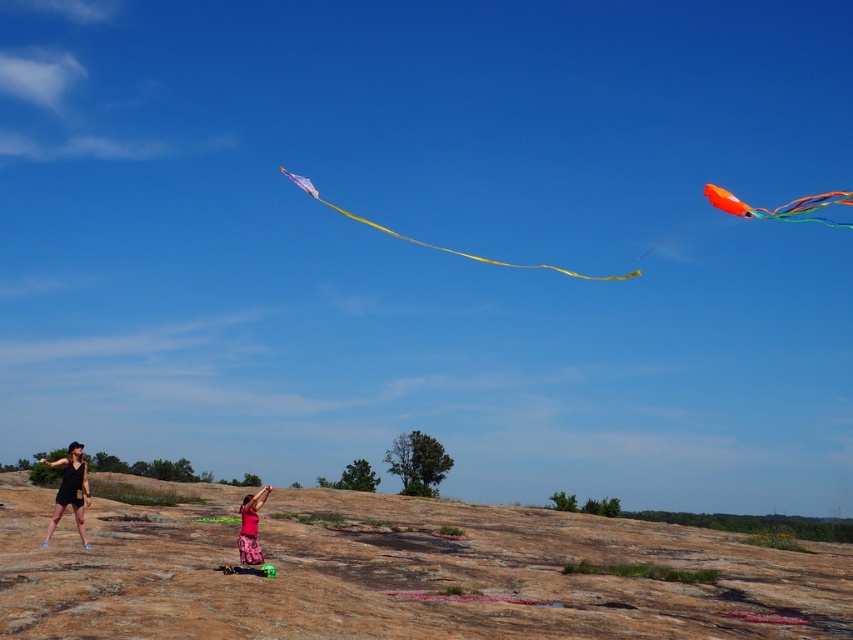
Measure the distance between point (834, 196) and camera.

Point (834, 196) is 15.99 meters from camera.

Does orange glossy kite at upper right appear under matte black shorts at lower left?

Actually, orange glossy kite at upper right is above matte black shorts at lower left.

Which is behind, point (827, 221) or point (57, 460)?

The point (57, 460) is behind.

The image size is (853, 640). What are the coordinates of `orange glossy kite at upper right` in the screenshot? It's located at (780, 205).

Is the position of brown rock at lower center less distant than that of translucent purple kite at center?

Yes, brown rock at lower center is in front of translucent purple kite at center.

Is point (90, 548) in front of point (474, 259)?

Yes, point (90, 548) is in front of point (474, 259).

Locate an element on the screen. This screenshot has width=853, height=640. brown rock at lower center is located at coordinates (393, 572).

This screenshot has height=640, width=853. I want to click on brown rock at lower center, so click(393, 572).

Does brown rock at lower center appear on the left side of matte pink skirt at center?

No, brown rock at lower center is not to the left of matte pink skirt at center.

Is brown rock at lower center thinner than matte pink skirt at center?

No, brown rock at lower center is not thinner than matte pink skirt at center.

You are a GUI agent. You are given a task and a screenshot of the screen. Output one action in this format:
    pyautogui.click(x=<x>, y=<y>)
    Task: Click on the brown rock at lower center
    
    Given the screenshot: What is the action you would take?
    pyautogui.click(x=393, y=572)

Locate an element on the screen. The height and width of the screenshot is (640, 853). brown rock at lower center is located at coordinates (393, 572).